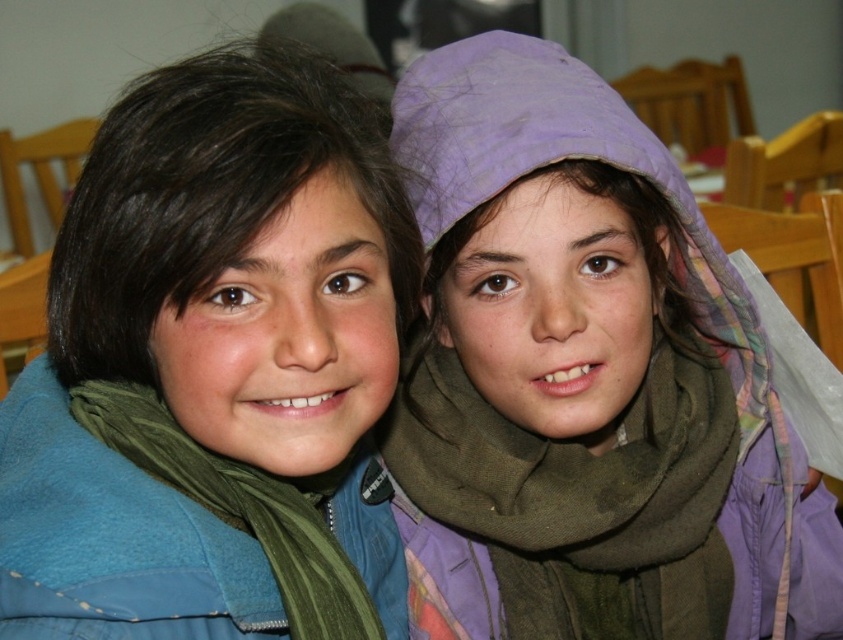
You are a photographer adjusting the camera focus. You need to ensure both the green fleece jacket at left and the green matte scarf at lower left are in focus. Which object should you adjust the focus on first to account for their sizes?

The green fleece jacket at left has a greater height compared to the green matte scarf at lower left, so you should focus on the larger green fleece jacket at left first to ensure proper focus on both objects.

You are a photographer trying to adjust the lighting for a photo of the purple fabric headscarf at upper right and the green fabric scarf at center. Which scarf is covering the other one?

The purple fabric headscarf at upper right is positioned over the green fabric scarf at center, so it is covering it.

You are a photographer setting up a shot of two children. You need to place a small prop between the two points marked in the image. Given that point (518, 166) is closer to you than point (449, 484), where should you position the prop so it appears centered between them in the photo?

The prop should be placed closer to point (518, 166) since it is nearer to the viewer, ensuring the prop appears centered between both points in the photo.